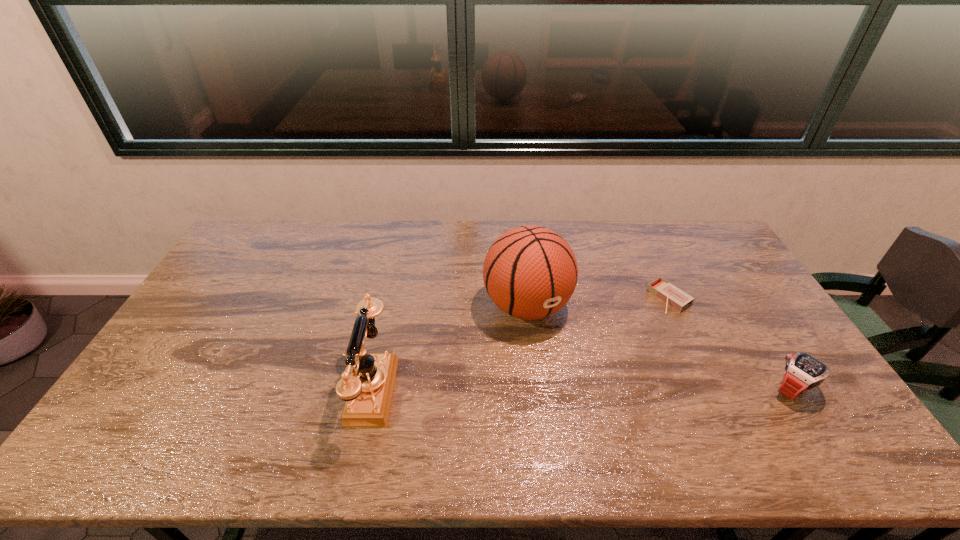
Where is `free spot located on the dial of the second tallest object`? The height and width of the screenshot is (540, 960). free spot located on the dial of the second tallest object is located at coordinates (222, 389).

At what (x,y) coordinates should I click in order to perform the action: click on vacant space located 0.380m on the left of the rightmost object. Please return your answer as a coordinate pair (x, y). Looking at the image, I should click on (625, 389).

What are the coordinates of `vacant space located 0.090m on the side where the inflation valve is located` in the screenshot? It's located at (564, 360).

Identify the location of free space located 0.130m on the side where the inflation valve is located. (571, 370).

Identify the location of free location located on the side where the inflation valve is located. (562, 357).

This screenshot has width=960, height=540. What are the coordinates of `vacant space situated on the striking surface of the third object from left to right` in the screenshot? It's located at (599, 346).

At what (x,y) coordinates should I click in order to perform the action: click on free space located on the striking surface of the third object from left to right. Please return your answer as a coordinate pair (x, y). The width and height of the screenshot is (960, 540). Looking at the image, I should click on (572, 364).

This screenshot has height=540, width=960. Identify the location of free space located 0.370m on the striking surface of the third object from left to right. (574, 363).

I want to click on telephone that is at the near edge, so click(x=367, y=384).

Identify the location of watch located in the near edge section of the desktop. (802, 372).